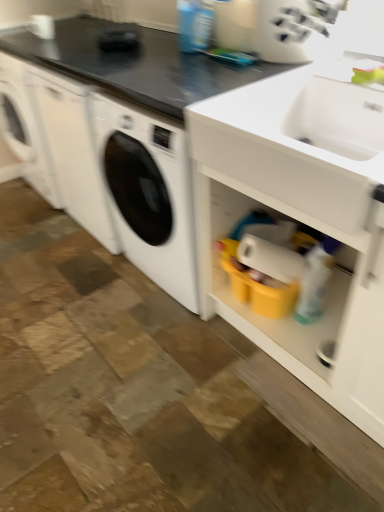
Question: Based on their sizes in the image, would you say white matte cabinet at lower right is bigger or smaller than black matte countertop at upper center?

Choices:
 (A) big
 (B) small

Answer: (A)

Question: From the image's perspective, is white matte cabinet at lower right positioned above or below black matte countertop at upper center?

Choices:
 (A) below
 (B) above

Answer: (A)

Question: Estimate the real-world distances between objects in this image. Which object is farther from the black matte countertop at upper center?

Choices:
 (A) white plastic knife block at upper center
 (B) white matte cabinet at lower right

Answer: (B)

Question: Which object is the farthest from the black matte countertop at upper center?

Choices:
 (A) white plastic knife block at upper center
 (B) white matte cabinet at lower right

Answer: (B)